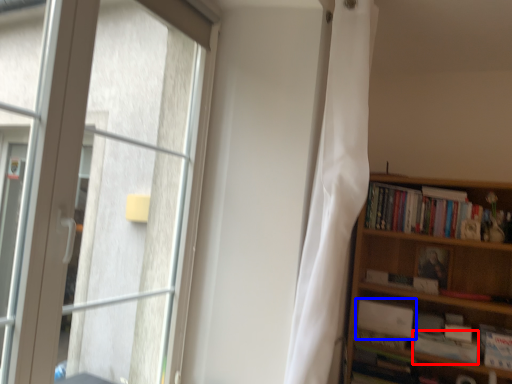
Question: Among these objects, which one is nearest to the camera, paperback book (highlighted by a red box) or book (highlighted by a blue box)?

Choices:
 (A) paperback book
 (B) book

Answer: (A)